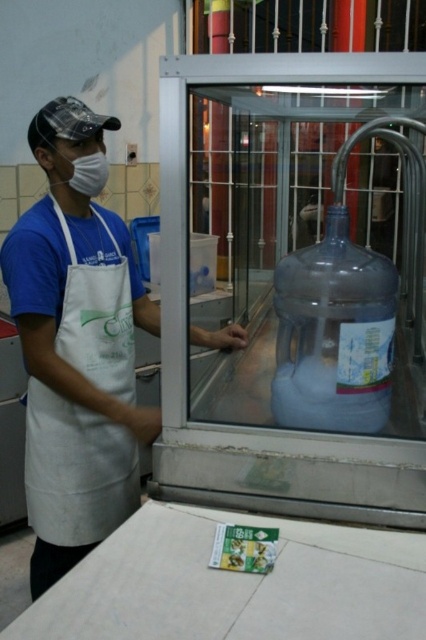
Is white apron at left positioned behind white matte mask at left?

That is False.

Identify the location of white apron at left. Image resolution: width=426 pixels, height=640 pixels. (75, 344).

The image size is (426, 640). Describe the element at coordinates (75, 344) in the screenshot. I see `white apron at left` at that location.

In order to click on white apron at left in this screenshot , I will do `click(75, 344)`.

The height and width of the screenshot is (640, 426). Describe the element at coordinates (75, 470) in the screenshot. I see `white cotton apron at left` at that location.

Is white cotton apron at left positioned at the back of transparent plastic bottle at center?

Yes, it is behind transparent plastic bottle at center.

Does point (80, 321) lie behind point (370, 380)?

Yes, point (80, 321) is behind point (370, 380).

The height and width of the screenshot is (640, 426). What are the coordinates of `white cotton apron at left` in the screenshot? It's located at (75, 470).

Is white cotton apron at left to the left of white matte mask at left from the viewer's perspective?

Incorrect, white cotton apron at left is not on the left side of white matte mask at left.

Does white cotton apron at left have a greater height compared to white matte mask at left?

Yes.

Is point (40, 515) closer to viewer compared to point (89, 196)?

No.

Identify the location of white cotton apron at left. This screenshot has height=640, width=426. (75, 470).